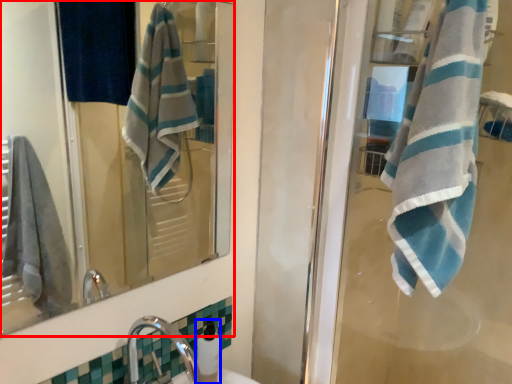
Question: Which object appears closest to the camera in this image, mirror (highlighted by a red box) or soap dispenser (highlighted by a blue box)?

Choices:
 (A) mirror
 (B) soap dispenser

Answer: (A)